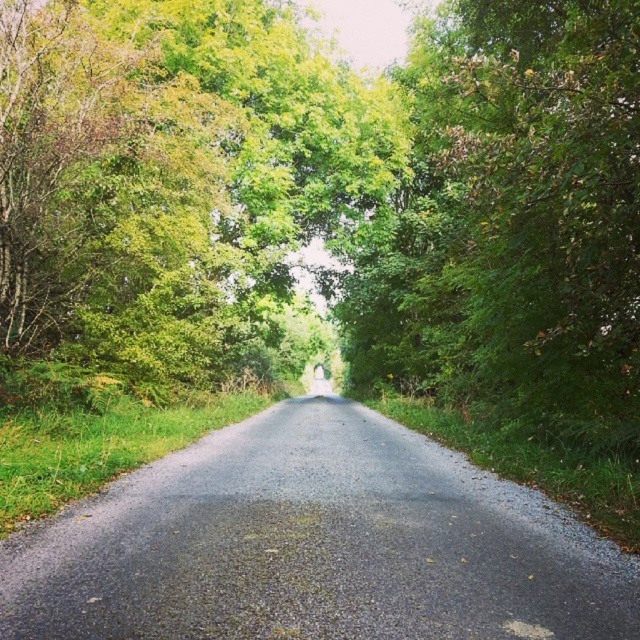
Which of these two, green leafy tree at center or black asphalt road at center, stands shorter?

With less height is black asphalt road at center.

Who is lower down, green leafy tree at center or black asphalt road at center?

black asphalt road at center is lower down.

Image resolution: width=640 pixels, height=640 pixels. Describe the element at coordinates (328, 192) in the screenshot. I see `green leafy tree at center` at that location.

Image resolution: width=640 pixels, height=640 pixels. Identify the location of green leafy tree at center. (328, 192).